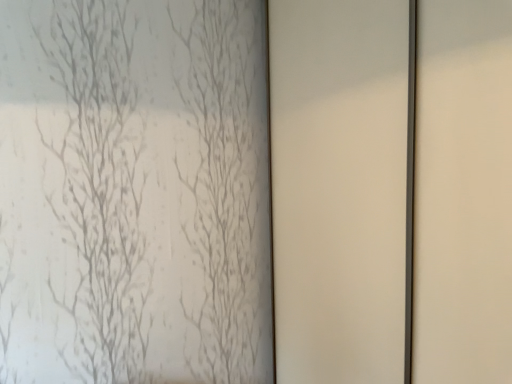
Consider the image. Measure the distance between point (397, 30) and camera.

The distance of point (397, 30) from camera is 4.06 feet.

Find the location of a particular element. The image size is (512, 384). transparent glass door at center is located at coordinates pos(339,188).

What do you see at coordinates (339, 188) in the screenshot? I see `transparent glass door at center` at bounding box center [339, 188].

Locate an element on the screen. This screenshot has width=512, height=384. transparent glass door at center is located at coordinates (339, 188).